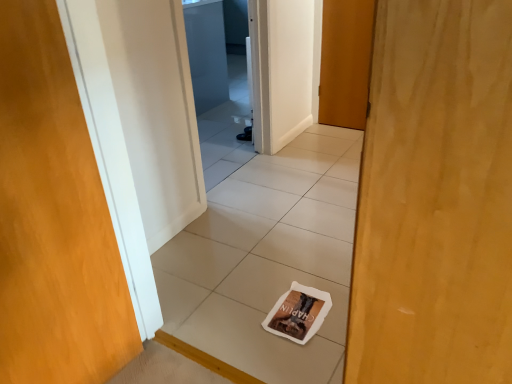
Identify the location of vacant area on the back side of brown paper magazine at center. coord(290,269).